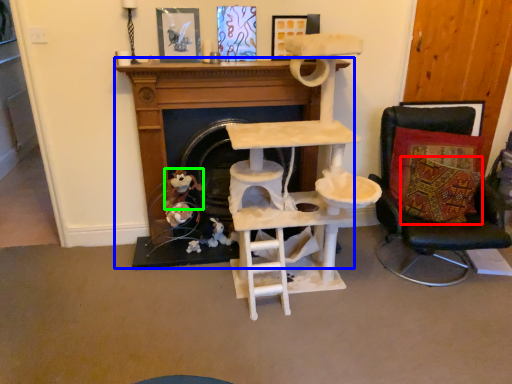
Question: Considering the real-world distances, which object is closest to pillow (highlighted by a red box)? fireplace (highlighted by a blue box) or toy (highlighted by a green box).

Choices:
 (A) fireplace
 (B) toy

Answer: (A)